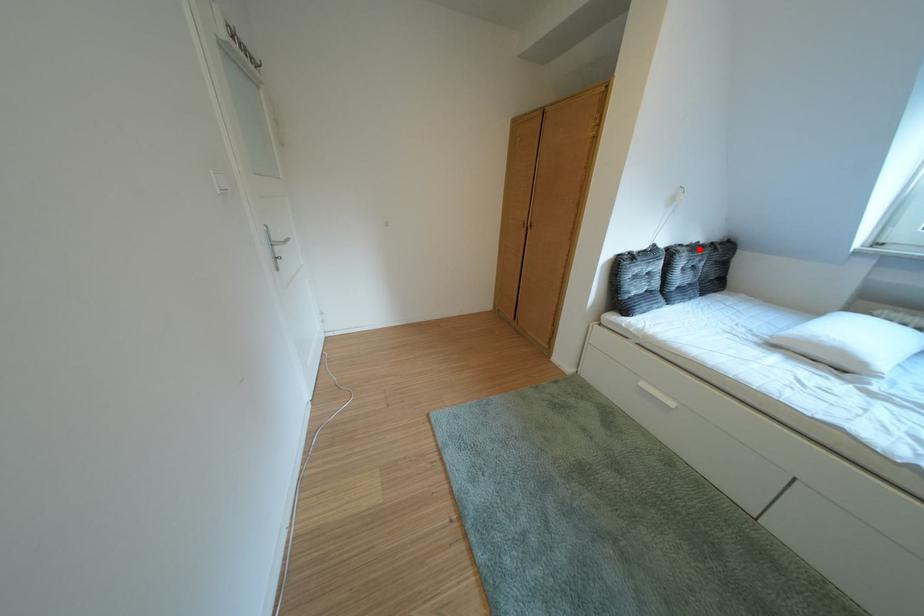
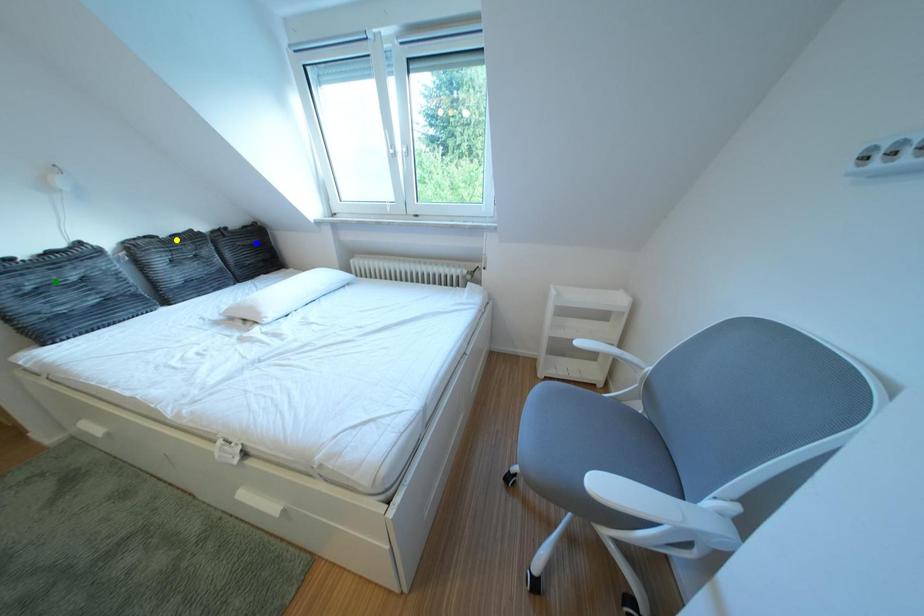
Question: I am providing you with two images of the same scene from different viewpoints. A red point is marked on the first image. You are given multiple points on the second image. Which point in image 2 is actually the same real-world point as the red point in image 1?

Choices:
 (A) yellow point
 (B) blue point
 (C) green point

Answer: (A)